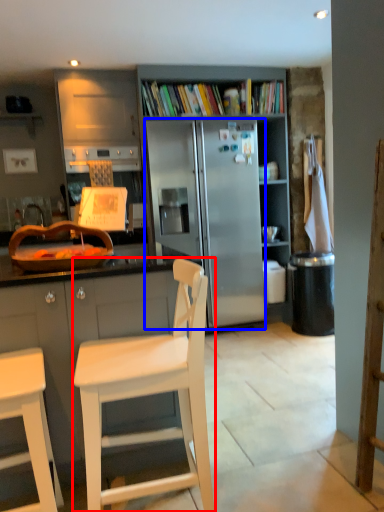
Question: Which of the following is the closest to the observer, chair (highlighted by a red box) or refrigerator (highlighted by a blue box)?

Choices:
 (A) chair
 (B) refrigerator

Answer: (A)